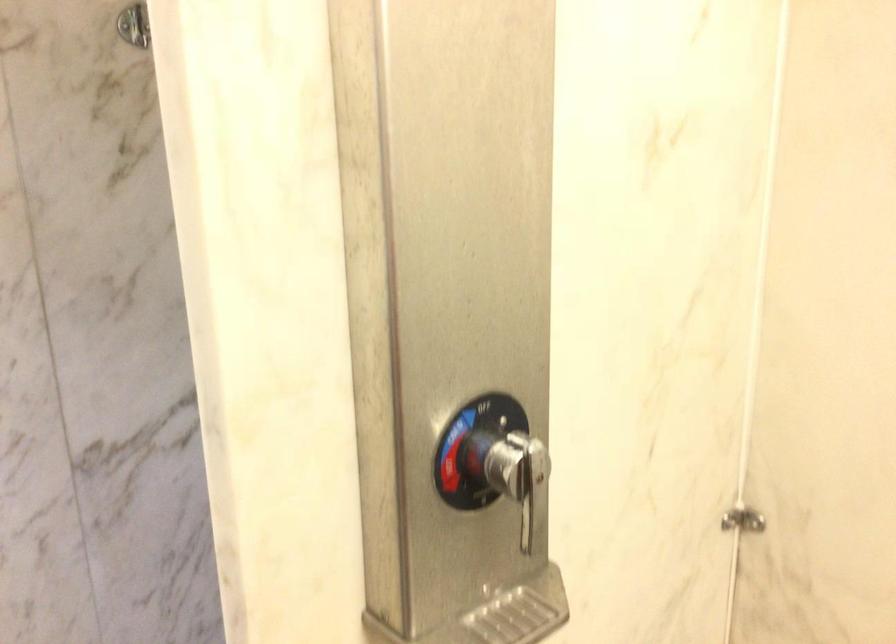
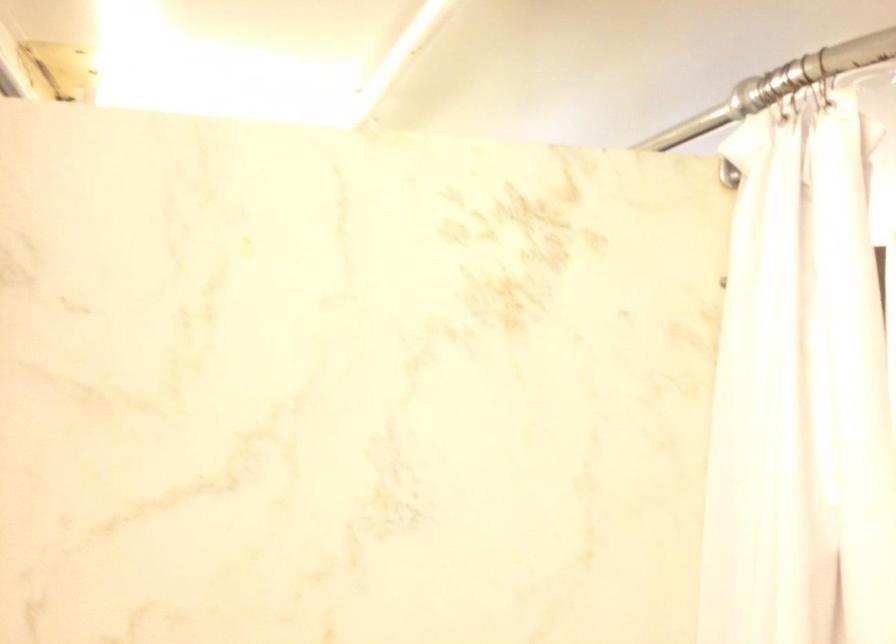
Question: The camera is either moving clockwise (left) or counter-clockwise (right) around the object. The first image is from the beginning of the video and the second image is from the end. Is the camera moving left or right when shooting the video?

Choices:
 (A) Left
 (B) Right

Answer: (B)